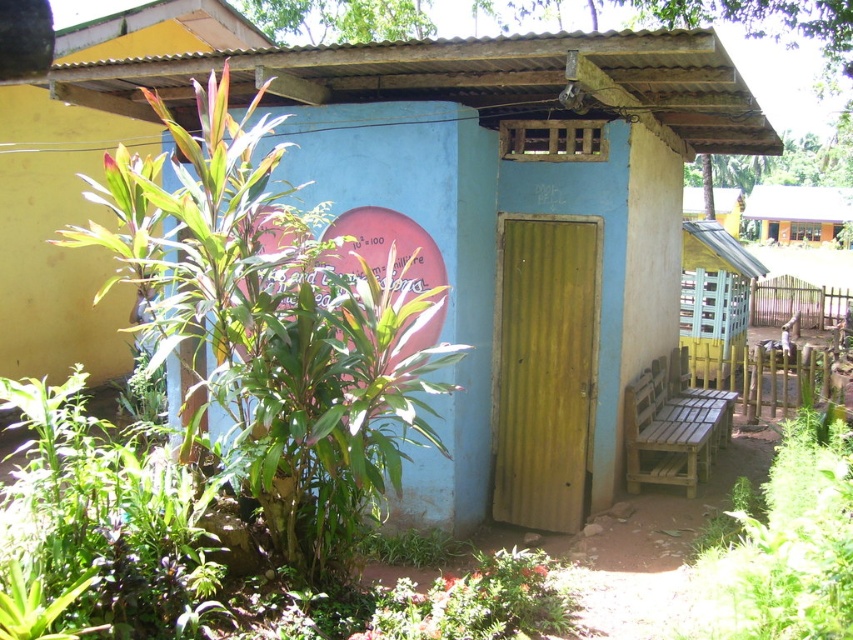
You are standing at the entrance of the building and want to know how far you are from the point marked at coordinates point (546, 307). Can you determine the distance?

The distance between you and point (546, 307) is 6.20 meters.